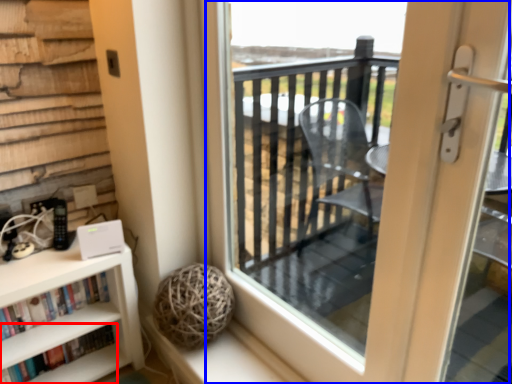
Question: Which point is further to the camera, book (highlighted by a red box) or screen door (highlighted by a blue box)?

Choices:
 (A) book
 (B) screen door

Answer: (A)